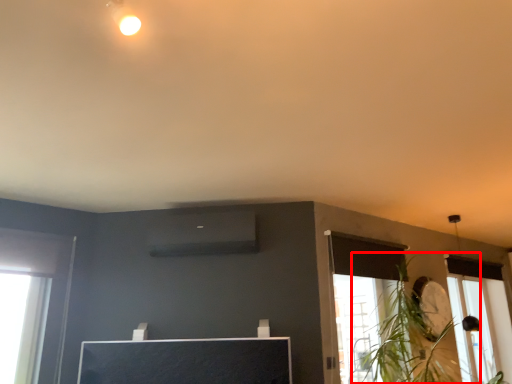
Question: From the image's perspective, where is plant (annotated by the red box) located relative to window?

Choices:
 (A) above
 (B) below

Answer: (A)